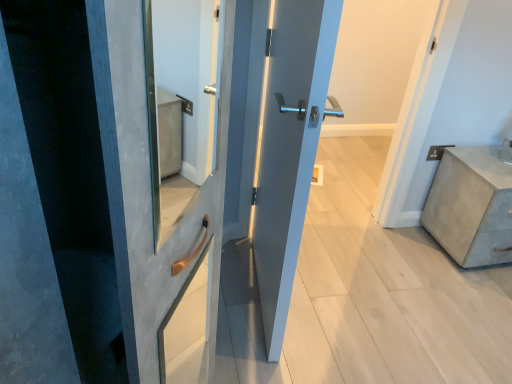
I want to click on free space in front of satin blue door at center, so click(x=266, y=356).